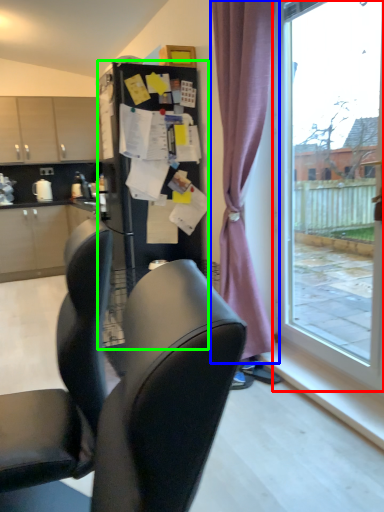
Question: Which is farther away from window (highlighted by a red box)? curtain (highlighted by a blue box) or fridge (highlighted by a green box)?

Choices:
 (A) curtain
 (B) fridge

Answer: (B)